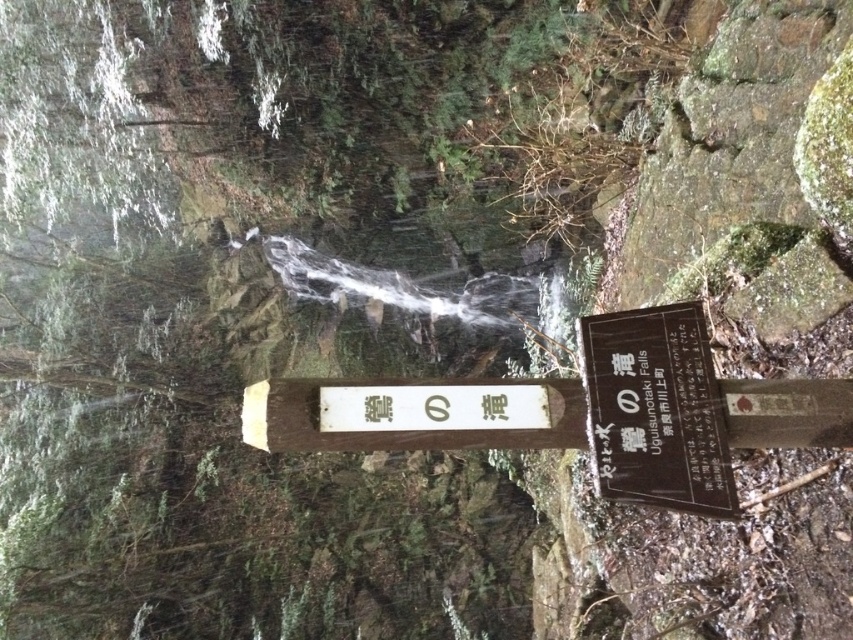
Question: Which object is closer to the camera taking this photo?

Choices:
 (A) black wood sign at center
 (B) clear water at center

Answer: (A)

Question: Among these objects, which one is farthest from the camera?

Choices:
 (A) clear water at center
 (B) black wood sign at center

Answer: (A)

Question: Does clear water at center come behind black wood sign at center?

Choices:
 (A) yes
 (B) no

Answer: (A)

Question: Considering the relative positions of clear water at center and black wood sign at center in the image provided, where is clear water at center located with respect to black wood sign at center?

Choices:
 (A) above
 (B) below

Answer: (A)

Question: Is clear water at center above black wood sign at center?

Choices:
 (A) yes
 (B) no

Answer: (A)